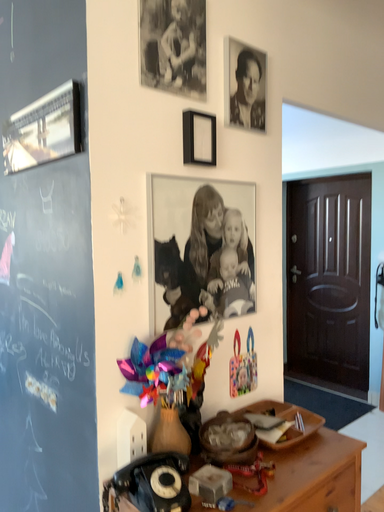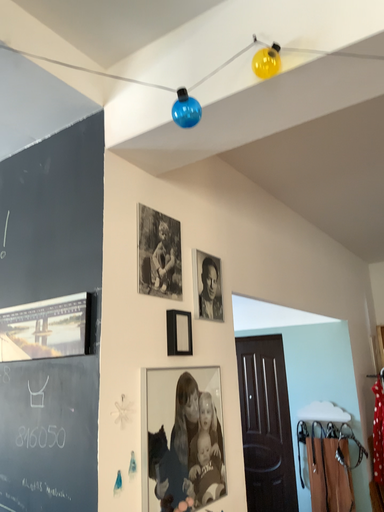
Question: How did the camera likely rotate when shooting the video?

Choices:
 (A) rotated downward
 (B) rotated upward

Answer: (B)